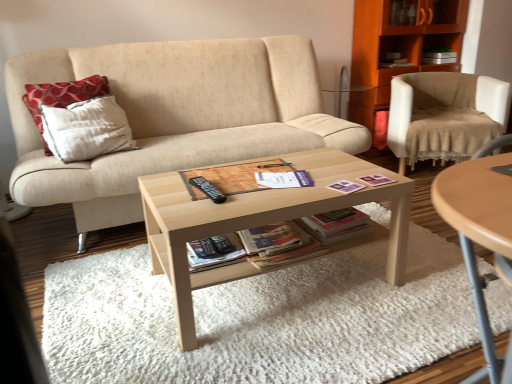
Where is `free space in front of light wood/texture coffee table at center`? The image size is (512, 384). free space in front of light wood/texture coffee table at center is located at coordinates (291, 349).